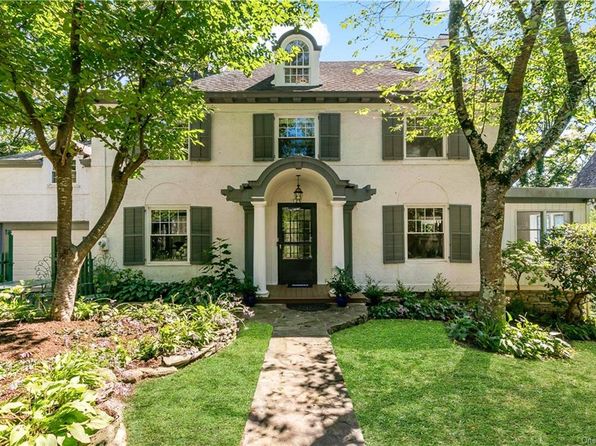
Where is `window shutters`? This screenshot has width=596, height=446. window shutters is located at coordinates (197, 218), (134, 224), (204, 144), (395, 148), (325, 141), (257, 142), (394, 244), (460, 235), (455, 145).